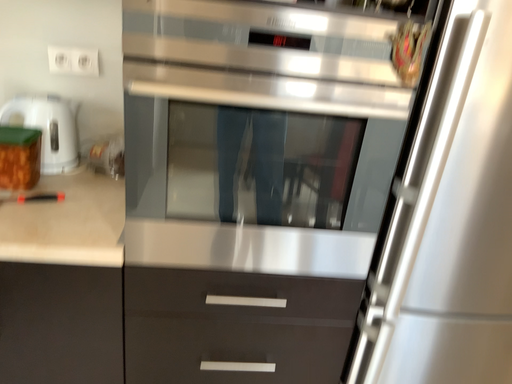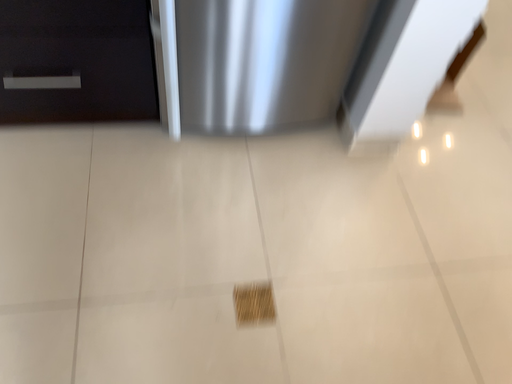
Question: How did the camera likely rotate when shooting the video?

Choices:
 (A) rotated downward
 (B) rotated upward

Answer: (A)